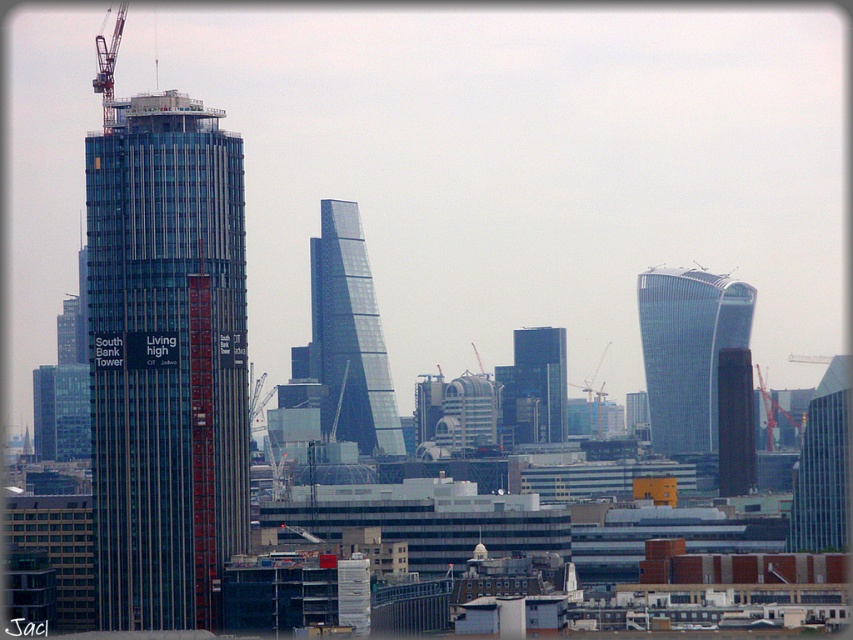
Question: Which of the following is the closest to the observer?

Choices:
 (A) (729, 392)
 (B) (108, 116)
 (C) (363, 440)

Answer: (C)

Question: Which point appears closest to the camera in this image?

Choices:
 (A) (520, 330)
 (B) (113, 61)
 (C) (844, 440)

Answer: (A)

Question: Can you confirm if glassy steel skyscraper at right is positioned above transparent glass skyscraper at center?

Choices:
 (A) yes
 (B) no

Answer: (B)

Question: Which point appears farthest from the camera in this image?

Choices:
 (A) (840, 445)
 (B) (578, 401)
 (C) (97, 568)

Answer: (A)

Question: Is glassy blue skyscraper at left smaller than red metal crane at right?

Choices:
 (A) yes
 (B) no

Answer: (B)

Question: Is glassy blue skyscraper at right positioned before metallic construction crane at center?

Choices:
 (A) no
 (B) yes

Answer: (A)